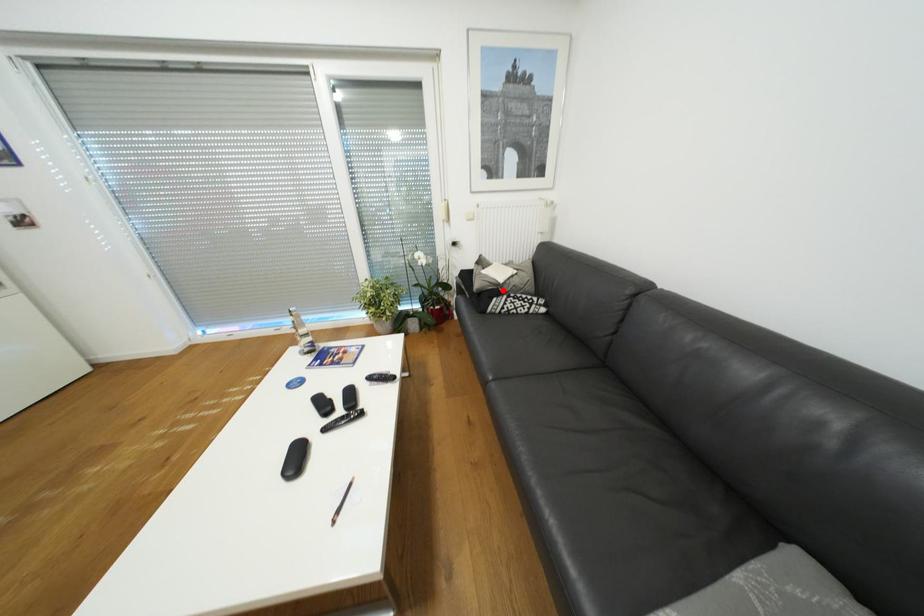
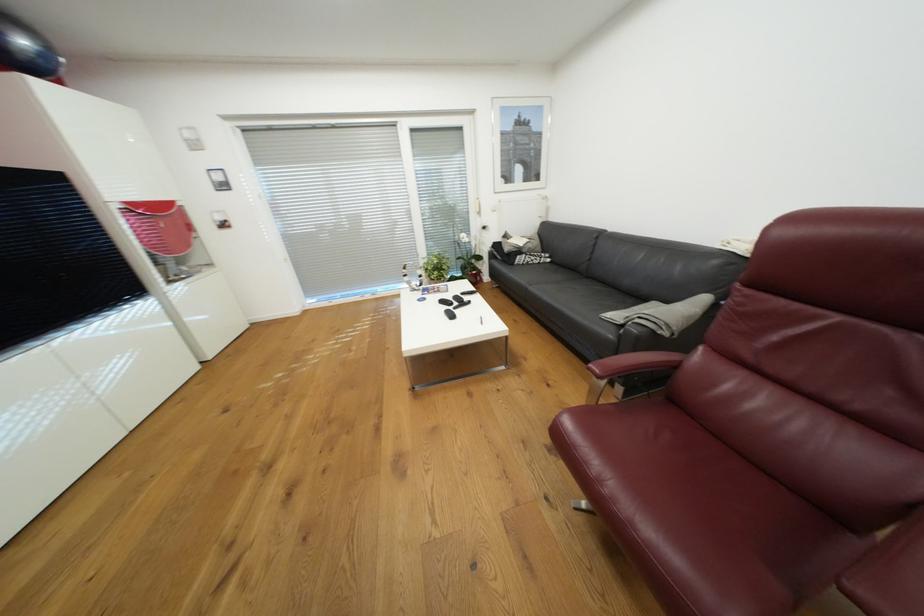
The point at the highlighted location is marked in the first image. Where is the corresponding point in the second image?

(526, 252)